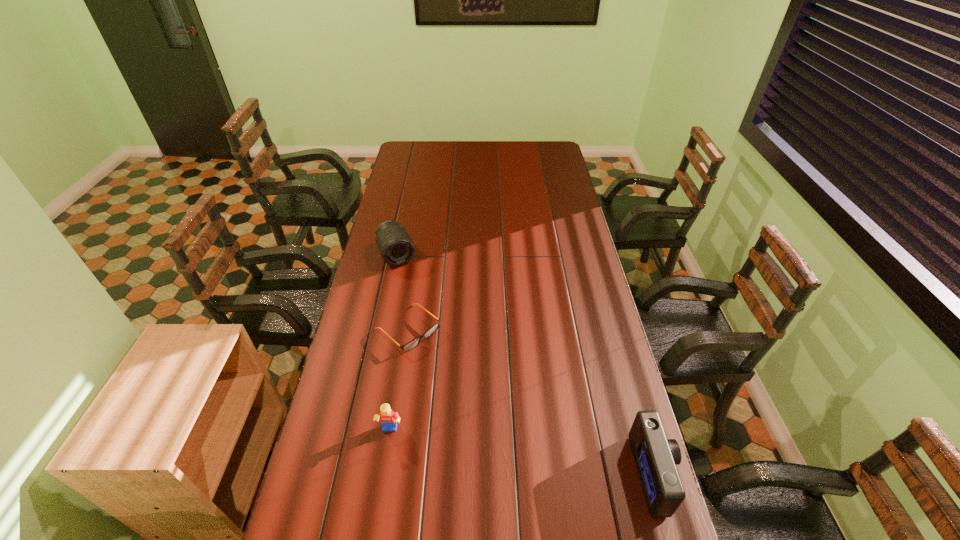
Identify the location of Lego. The width and height of the screenshot is (960, 540). (388, 418).

Find the location of a particular element. The width and height of the screenshot is (960, 540). the rightmost object is located at coordinates (656, 457).

Identify the location of telephoto lens. (396, 247).

The width and height of the screenshot is (960, 540). What are the coordinates of `spectacles` in the screenshot? It's located at (413, 343).

Locate an element on the screen. the second farthest object is located at coordinates (413, 343).

The image size is (960, 540). Find the location of `vacant space located on the face of the second shortest object`. vacant space located on the face of the second shortest object is located at coordinates (377, 514).

What are the coordinates of `vacant space located on the surface of the farthest object` in the screenshot? It's located at (410, 283).

Identify the location of free space located on the surface of the farthest object. The image size is (960, 540). tap(429, 322).

The image size is (960, 540). I want to click on vacant space located on the surface of the farthest object, so click(x=430, y=324).

Find the location of `vacant space located 0.090m on the front-facing side of the third nearest object`. vacant space located 0.090m on the front-facing side of the third nearest object is located at coordinates (446, 363).